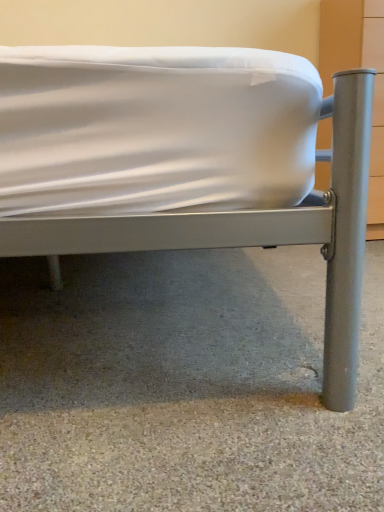
Question: Looking at the image, does gray carpet at lower center seem bigger or smaller compared to metallic gray bed at center?

Choices:
 (A) small
 (B) big

Answer: (A)

Question: Is gray carpet at lower center wider or thinner than metallic gray bed at center?

Choices:
 (A) thin
 (B) wide

Answer: (B)

Question: From a real-world perspective, relative to metallic gray bed at center, is gray carpet at lower center vertically above or below?

Choices:
 (A) above
 (B) below

Answer: (B)

Question: Considering the positions of metallic gray bed at center and gray carpet at lower center in the image, is metallic gray bed at center bigger or smaller than gray carpet at lower center?

Choices:
 (A) big
 (B) small

Answer: (A)

Question: Does point (34, 56) appear closer or farther from the camera than point (11, 259)?

Choices:
 (A) farther
 (B) closer

Answer: (B)

Question: Visually, is metallic gray bed at center positioned to the left or to the right of gray carpet at lower center?

Choices:
 (A) left
 (B) right

Answer: (A)

Question: From a real-world perspective, is metallic gray bed at center positioned above or below gray carpet at lower center?

Choices:
 (A) above
 (B) below

Answer: (A)